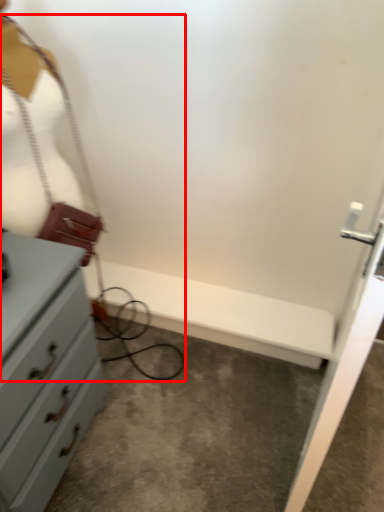
Question: From the image, what is the correct spatial relationship of wire (annotated by the red box) in relation to mannequin?

Choices:
 (A) left
 (B) right

Answer: (A)